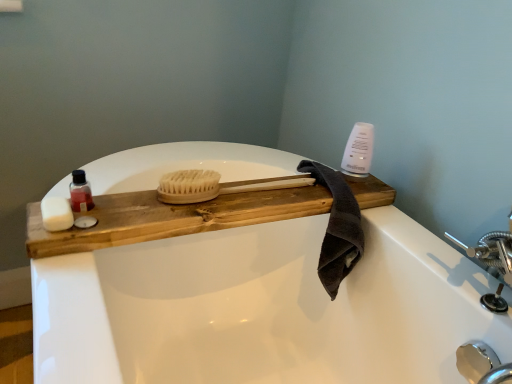
Question: Is white matte soap at left, placed as the first soap when sorted from right to left, bigger or smaller than natural wood tray at center?

Choices:
 (A) small
 (B) big

Answer: (A)

Question: From the image's perspective, is white matte soap at left, marked as the 2th soap in a left-to-right arrangement, positioned above or below natural wood tray at center?

Choices:
 (A) above
 (B) below

Answer: (B)

Question: Which of these objects is positioned closest to the white matte soap at left, marked as the 2th soap in a left-to-right arrangement?

Choices:
 (A) translucent plastic bottle at left
 (B) natural wood brush at center
 (C) polished chrome faucet at lower right
 (D) natural wood tray at center
 (E) white matte soap at left, arranged as the second soap when viewed from the right

Answer: (E)

Question: Estimate the real-world distances between objects in this image. Which object is farther from the dark gray cotton towel at upper right?

Choices:
 (A) polished chrome faucet at lower right
 (B) white matte soap at left, arranged as the second soap when viewed from the right
 (C) natural wood brush at center
 (D) white matte soap at left, placed as the first soap when sorted from right to left
 (E) natural wood tray at center

Answer: (A)